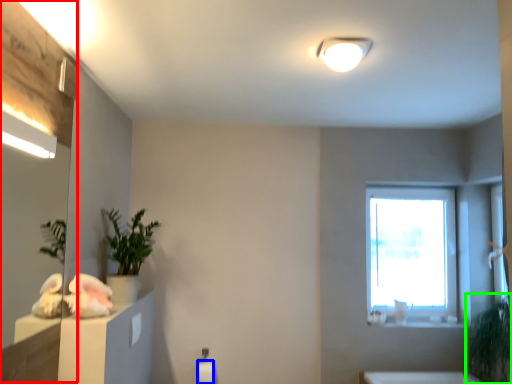
Question: Based on their relative distances, which object is nearer to mirror (highlighted by a red box)? Choose from toilet paper (highlighted by a blue box) and plant (highlighted by a green box).

Choices:
 (A) toilet paper
 (B) plant

Answer: (A)